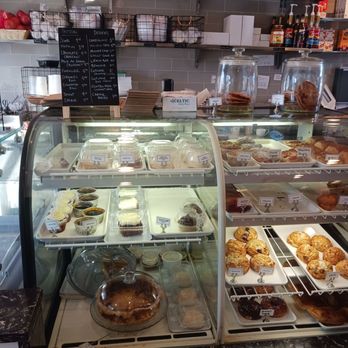
Locate an element on the screen. This screenshot has height=348, width=348. chalkboard is located at coordinates (90, 58).